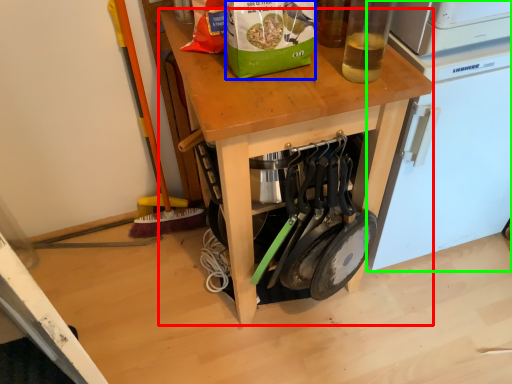
Question: Which is nearer to the desk (highlighted by a red box)? paper bag (highlighted by a blue box) or home appliance (highlighted by a green box).

Choices:
 (A) paper bag
 (B) home appliance

Answer: (A)